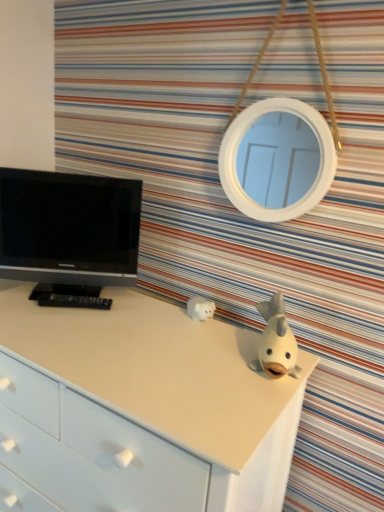
Question: From the image's perspective, is white matte chest of drawers at center below white matte piggy bank at center, positioned as the second toy in front-to-back order?

Choices:
 (A) yes
 (B) no

Answer: (A)

Question: Does white matte chest of drawers at center have a smaller size compared to white matte piggy bank at center, which is counted as the first toy, starting from the left?

Choices:
 (A) yes
 (B) no

Answer: (B)

Question: Considering the relative sizes of white matte chest of drawers at center and white matte piggy bank at center, which is counted as the first toy, starting from the left, in the image provided, is white matte chest of drawers at center shorter than white matte piggy bank at center, which is counted as the first toy, starting from the left,?

Choices:
 (A) no
 (B) yes

Answer: (A)

Question: Is white matte chest of drawers at center at the left side of white matte piggy bank at center, the first toy from the back?

Choices:
 (A) no
 (B) yes

Answer: (B)

Question: Does white matte chest of drawers at center lie in front of white matte piggy bank at center, positioned as the second toy in front-to-back order?

Choices:
 (A) no
 (B) yes

Answer: (B)

Question: In terms of height, does white matte piggy bank at center, the first toy from the back, look taller or shorter compared to white matte fish at upper right, arranged as the first toy when viewed from the front?

Choices:
 (A) short
 (B) tall

Answer: (A)

Question: From a real-world perspective, is white matte piggy bank at center, the second toy from the right, physically located above or below white matte fish at upper right, the 2th toy viewed from the left?

Choices:
 (A) below
 (B) above

Answer: (A)

Question: Would you say white matte piggy bank at center, the first toy from the back, is to the left or to the right of white matte fish at upper right, placed as the 1th toy when sorted from right to left, in the picture?

Choices:
 (A) left
 (B) right

Answer: (A)

Question: Is white matte piggy bank at center, the first toy from the back, wider or thinner than white matte fish at upper right, the 2th toy viewed from the left?

Choices:
 (A) thin
 (B) wide

Answer: (A)

Question: From a real-world perspective, relative to white matte piggy bank at center, which is counted as the first toy, starting from the left, is white matte chest of drawers at center vertically above or below?

Choices:
 (A) below
 (B) above

Answer: (A)

Question: Looking at their shapes, would you say white matte chest of drawers at center is wider or thinner than white matte piggy bank at center, positioned as the second toy in front-to-back order?

Choices:
 (A) wide
 (B) thin

Answer: (A)

Question: Considering the positions of point click(x=241, y=416) and point click(x=208, y=312), is point click(x=241, y=416) closer or farther from the camera than point click(x=208, y=312)?

Choices:
 (A) farther
 (B) closer

Answer: (B)

Question: Would you say white matte chest of drawers at center is to the left or to the right of white matte piggy bank at center, positioned as the second toy in front-to-back order, in the picture?

Choices:
 (A) right
 (B) left

Answer: (B)

Question: Is black glossy tv at left wider or thinner than white matte piggy bank at center, which is counted as the first toy, starting from the left?

Choices:
 (A) thin
 (B) wide

Answer: (B)

Question: Is black glossy tv at left in front of or behind white matte piggy bank at center, the first toy from the back, in the image?

Choices:
 (A) front
 (B) behind

Answer: (A)